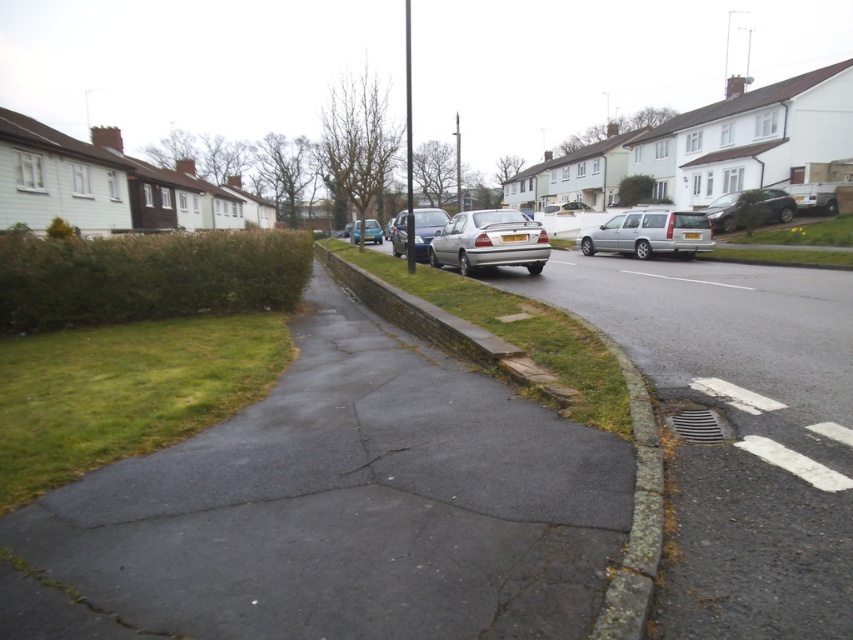
Can you confirm if green grass at center is taller than blue metallic car at center?

No, green grass at center is not taller than blue metallic car at center.

The width and height of the screenshot is (853, 640). What are the coordinates of `green grass at center` in the screenshot? It's located at (517, 332).

Can you confirm if green grass at lower left is positioned to the right of satin silver sedan at center?

No, green grass at lower left is not to the right of satin silver sedan at center.

Does point (134, 428) lie behind point (461, 252)?

No.

Locate an element on the screen. The height and width of the screenshot is (640, 853). green grass at lower left is located at coordinates (125, 392).

Is point (287, 499) farther from camera compared to point (341, 472)?

That is False.

Can you confirm if dark gray asphalt at center is positioned below cracked asphalt at center?

Yes.

Where is `dark gray asphalt at center`? dark gray asphalt at center is located at coordinates (337, 509).

Image resolution: width=853 pixels, height=640 pixels. I want to click on dark gray asphalt at center, so click(x=337, y=509).